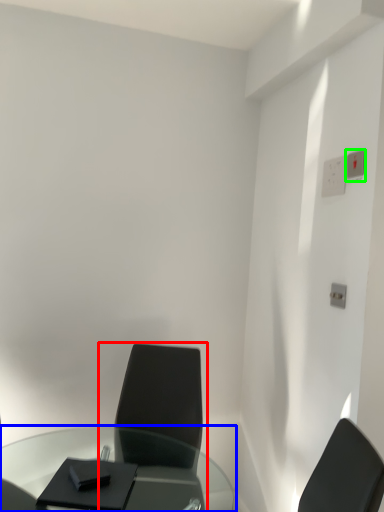
Question: Which object is positioned closest to chair (highlighted by a red box)? Select from table (highlighted by a blue box) and electric outlet (highlighted by a green box).

Choices:
 (A) table
 (B) electric outlet

Answer: (A)